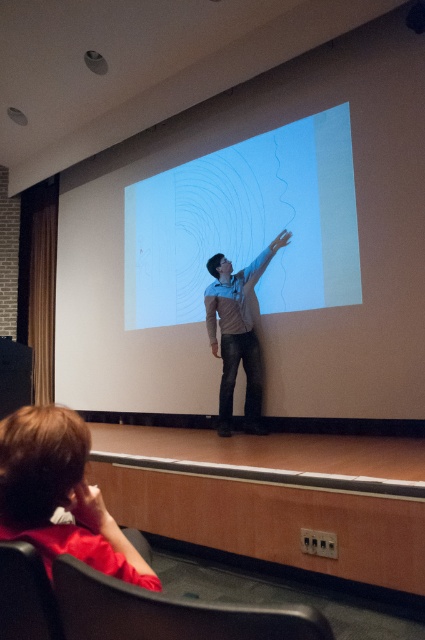
You are sitting in the audience and want to move from your seat to the front of the stage. There is a black leather chair at lower left and denim jeans at center in your way. Which object is closer to you so you have to step over or around it first?

The black leather chair at lower left is closer to you, so you have to step over or around it first before reaching the denim jeans at center.

You are an attendee in the lecture hall. You need to move from your seat to the front to ask a question. Your seat is near the black leather chair at lower left. The path to the front is clear except for the white matte projection screen at center. Can you walk around the screen without any obstruction?

The white matte projection screen at center might be wider than black leather chair at lower left, so it is possible that the screen is wider and thus harder to navigate around. However, since the path is clear except for the screen, you should be able to walk around it as long as there are no physical obstructions on either side.

You are an event planner setting up a conference room. You need to place a 2.5 meter long table between the white matte projection screen at center and the black leather chair at lower left. Will there be enough space to fit the table between them?

The distance between the white matte projection screen at center and the black leather chair at lower left is 4.37 meters. Since the table is 2.5 meters long, there is sufficient space to place it between them as 4.37 meters is greater than 2.5 meters.